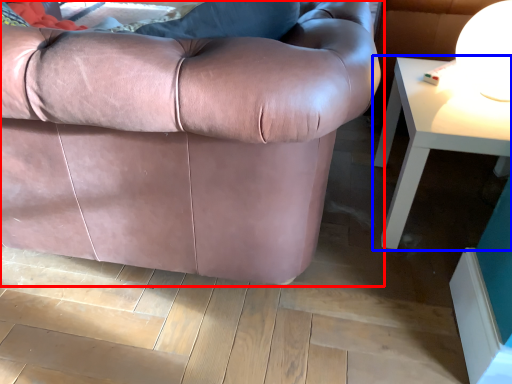
Question: Which object is further to the camera taking this photo, studio couch (highlighted by a red box) or table (highlighted by a blue box)?

Choices:
 (A) studio couch
 (B) table

Answer: (B)